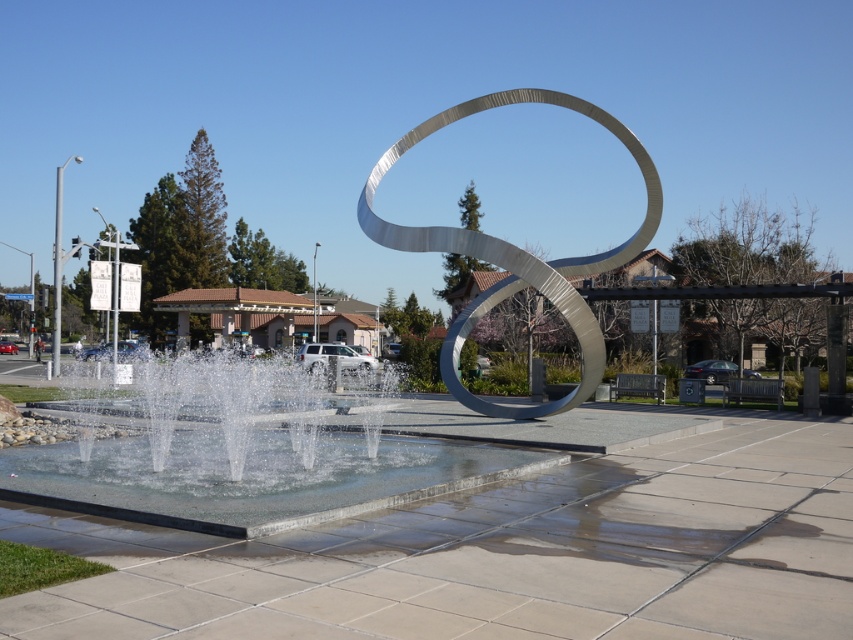
Question: Which object is positioned farthest from the silver metallic sculpture at center?

Choices:
 (A) clear water at center
 (B) clear glass water at center

Answer: (A)

Question: Can you confirm if clear glass water at center is bigger than clear water at center?

Choices:
 (A) no
 (B) yes

Answer: (B)

Question: Which of the following is the closest to the observer?

Choices:
 (A) (646, 224)
 (B) (202, 401)
 (C) (460, 452)

Answer: (C)

Question: Does clear glass water at center appear under clear water at center?

Choices:
 (A) yes
 (B) no

Answer: (B)

Question: Does clear glass water at center lie behind silver metallic sculpture at center?

Choices:
 (A) no
 (B) yes

Answer: (A)

Question: Among these objects, which one is nearest to the camera?

Choices:
 (A) clear glass water at center
 (B) clear water at center
 (C) silver metallic sculpture at center

Answer: (A)